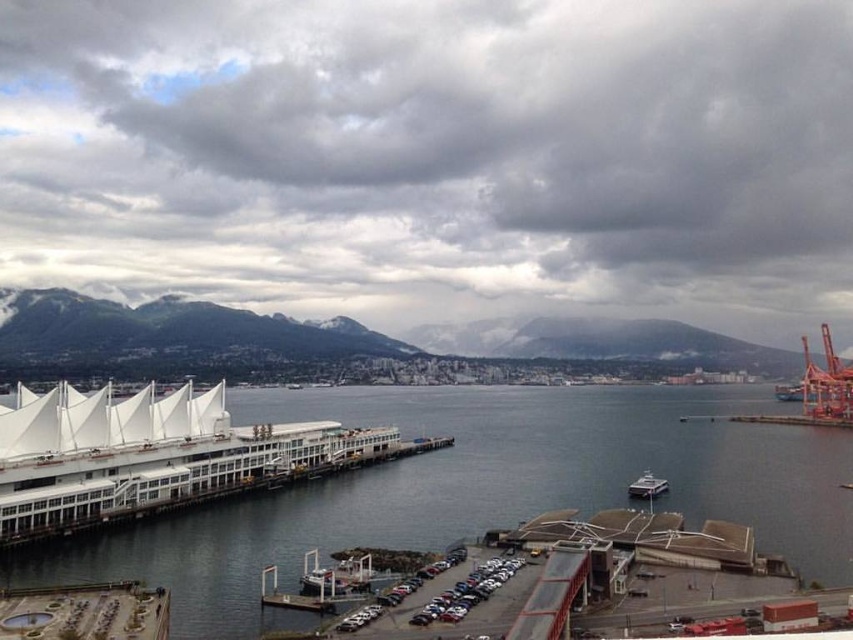
Question: Is transparent glass water at center positioned behind white glossy boat at center?

Choices:
 (A) no
 (B) yes

Answer: (A)

Question: Is transparent glass water at center smaller than white glossy boat at center?

Choices:
 (A) no
 (B) yes

Answer: (A)

Question: Which of the following is the closest to the observer?

Choices:
 (A) (418, 525)
 (B) (637, 481)

Answer: (A)

Question: Which object appears farthest from the camera in this image?

Choices:
 (A) white glossy boat at center
 (B) transparent glass water at center

Answer: (A)

Question: Among these objects, which one is farthest from the camera?

Choices:
 (A) white glossy boat at center
 (B) transparent glass water at center

Answer: (A)

Question: Is transparent glass water at center below white glossy boat at center?

Choices:
 (A) yes
 (B) no

Answer: (A)